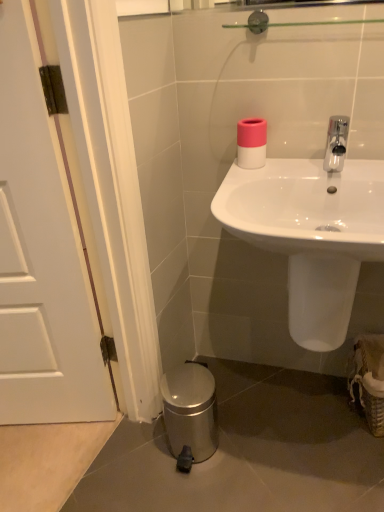
Locate an element on the screen. blank space to the left of polished chrome faucet at upper right is located at coordinates (286, 172).